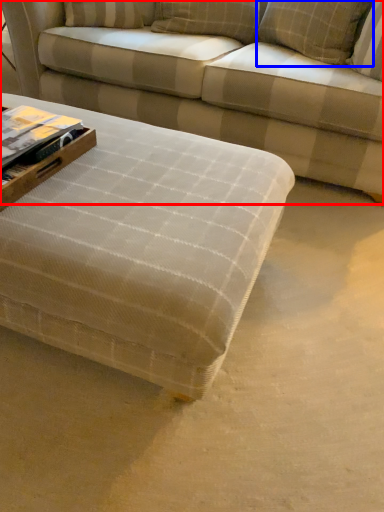
Question: Among these objects, which one is farthest to the camera, studio couch (highlighted by a red box) or pillow (highlighted by a blue box)?

Choices:
 (A) studio couch
 (B) pillow

Answer: (B)